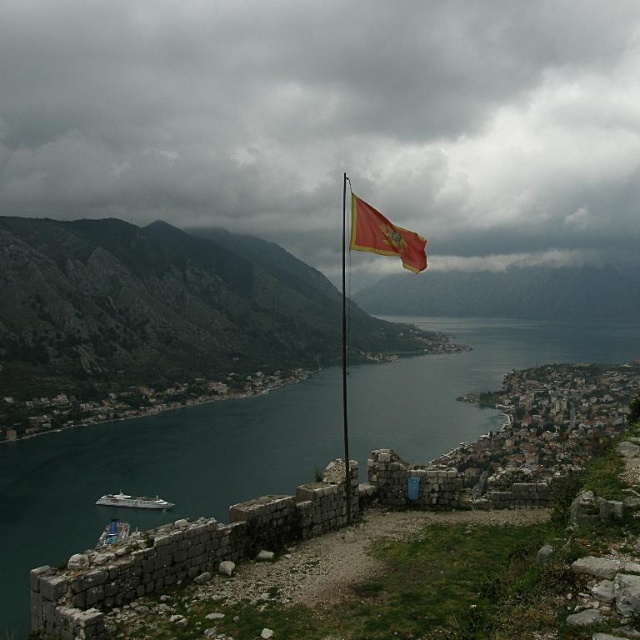
You are standing at the vantage point overlooking the bay and want to take a photo. There are two points marked in the image. The first point is at coordinate point [22,492] and the second point is at coordinate point [150,500]. Which point is closer to you?

Point [22,492] is further to the camera than point [150,500], so the point closer to you is point [150,500].

You are a tourist standing at the stone wall and want to take a photo of the green water at center and the red fabric flag at center. Which object will appear closer to you in the photo?

The red fabric flag at center is behind the green water at center, so the green water at center will appear closer to you in the photo.

Looking at this image, you are standing at the vantage point overlooking the bay. There is a specific point marked at coordinates point (356, 202). If you want to throw a stone to reach that point, considering the distance, is it possible for you to do so?

The point (356, 202) is 53.22 meters away from the viewer. Since the average human can throw a stone about 20 meters, it is not possible to reach that distance with a single throw.